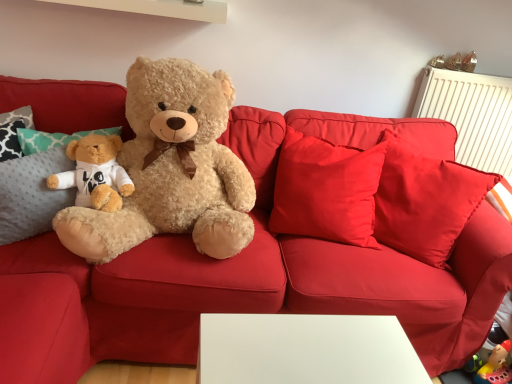
Question: From the image's perspective, is metallic gold earrings at upper right, positioned as the second toy in left-to-right order, located above or below matte brown teddy bear at upper right, which appears as the first toy when viewed from the left?

Choices:
 (A) below
 (B) above

Answer: (A)

Question: Considering the positions of point (468, 54) and point (448, 59), is point (468, 54) closer or farther from the camera than point (448, 59)?

Choices:
 (A) closer
 (B) farther

Answer: (B)

Question: Which object is the closest to the fluffy beige teddy bear at left?

Choices:
 (A) metallic gold earrings at upper right, which is the 1th toy from right to left
 (B) matte brown teddy bear at upper right, which appears as the first toy when viewed from the left

Answer: (B)

Question: Estimate the real-world distances between objects in this image. Which object is farther from the metallic gold earrings at upper right, positioned as the second toy in left-to-right order?

Choices:
 (A) matte brown teddy bear at upper right, acting as the second toy starting from the right
 (B) fluffy beige teddy bear at left

Answer: (B)